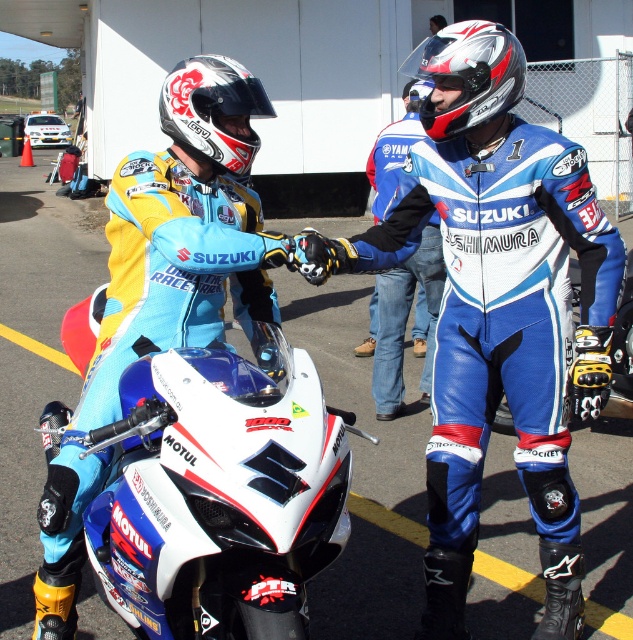
Describe the element at coordinates (192, 400) in the screenshot. The width and height of the screenshot is (633, 640). I see `matte blue suit at center` at that location.

Is matte blue suit at center below silver/textured helmet at upper center?

Yes.

Between point (97, 429) and point (446, 68), which one is positioned in front?

Point (97, 429) is more forward.

At what (x,y) coordinates should I click in order to perform the action: click on matte blue suit at center. Please return your answer as a coordinate pair (x, y). Image resolution: width=633 pixels, height=640 pixels. Looking at the image, I should click on click(x=192, y=400).

Between point (234, 122) and point (541, 552), which one is positioned in front?

Positioned in front is point (234, 122).

Is point (182, 605) behind point (489, 38)?

No.

Which is behind, point (203, 352) or point (479, 218)?

The point (479, 218) is more distant.

I want to click on matte blue suit at center, so click(x=192, y=400).

Who is positioned more to the right, white glossy helmet at upper center or silver/textured helmet at upper center?

silver/textured helmet at upper center

The image size is (633, 640). What do you see at coordinates (213, 112) in the screenshot?
I see `white glossy helmet at upper center` at bounding box center [213, 112].

Where is `white glossy helmet at upper center`? The image size is (633, 640). white glossy helmet at upper center is located at coordinates [x=213, y=112].